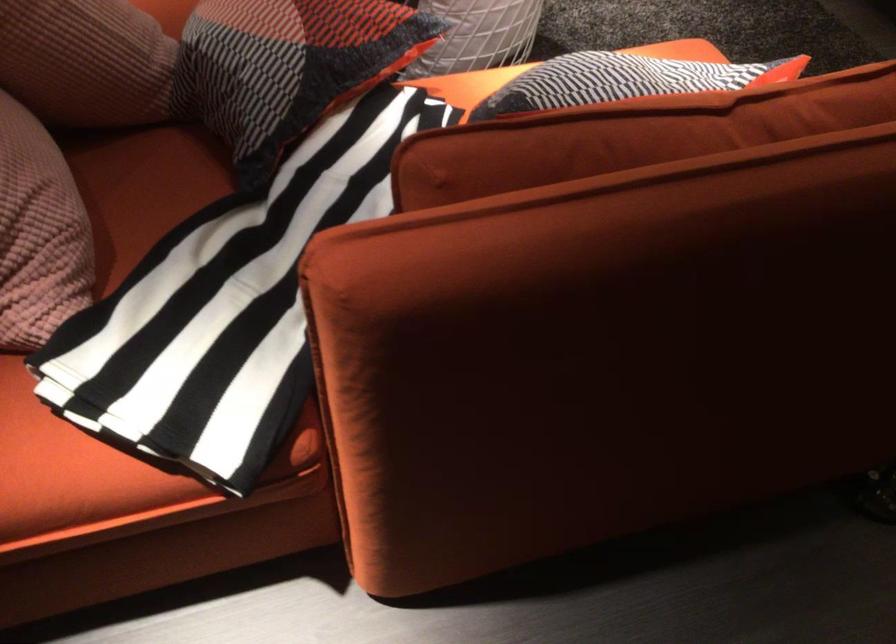
Image resolution: width=896 pixels, height=644 pixels. What do you see at coordinates (142, 187) in the screenshot? I see `the sofa sitting surface` at bounding box center [142, 187].